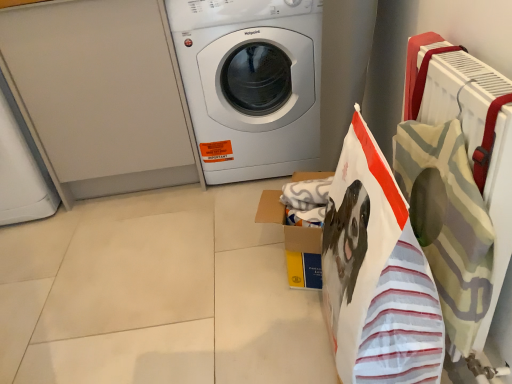
Question: Does white glossy washing machine at center turn towards yellow cardboard box at center?

Choices:
 (A) yes
 (B) no

Answer: (A)

Question: From a real-world perspective, is white glossy washing machine at center positioned under yellow cardboard box at center based on gravity?

Choices:
 (A) yes
 (B) no

Answer: (B)

Question: Is white glossy washing machine at center to the right of yellow cardboard box at center from the viewer's perspective?

Choices:
 (A) yes
 (B) no

Answer: (B)

Question: Considering the relative sizes of white glossy washing machine at center and yellow cardboard box at center in the image provided, is white glossy washing machine at center taller than yellow cardboard box at center?

Choices:
 (A) no
 (B) yes

Answer: (B)

Question: From the image's perspective, does white glossy washing machine at center appear lower than yellow cardboard box at center?

Choices:
 (A) no
 (B) yes

Answer: (A)

Question: Looking at their shapes, would you say white striped fabric shopping bag at right is wider or thinner than white glossy washing machine at center?

Choices:
 (A) wide
 (B) thin

Answer: (B)

Question: From a real-world perspective, is white striped fabric shopping bag at right positioned above or below white glossy washing machine at center?

Choices:
 (A) below
 (B) above

Answer: (A)

Question: Does point (425, 263) appear closer or farther from the camera than point (309, 125)?

Choices:
 (A) closer
 (B) farther

Answer: (A)

Question: Considering the positions of white striped fabric shopping bag at right and white glossy washing machine at center in the image, is white striped fabric shopping bag at right taller or shorter than white glossy washing machine at center?

Choices:
 (A) short
 (B) tall

Answer: (A)

Question: Would you say white glossy washing machine at center is inside or outside yellow cardboard box at center?

Choices:
 (A) outside
 (B) inside

Answer: (A)

Question: Is white glossy washing machine at center bigger or smaller than yellow cardboard box at center?

Choices:
 (A) small
 (B) big

Answer: (B)

Question: From the image's perspective, relative to yellow cardboard box at center, is white glossy washing machine at center above or below?

Choices:
 (A) above
 (B) below

Answer: (A)

Question: Considering their positions, is white glossy washing machine at center located in front of or behind yellow cardboard box at center?

Choices:
 (A) behind
 (B) front

Answer: (A)

Question: Considering the positions of white striped fabric shopping bag at right and yellow cardboard box at center in the image, is white striped fabric shopping bag at right bigger or smaller than yellow cardboard box at center?

Choices:
 (A) small
 (B) big

Answer: (B)

Question: Considering the positions of point pyautogui.click(x=417, y=342) and point pyautogui.click(x=294, y=264), is point pyautogui.click(x=417, y=342) closer or farther from the camera than point pyautogui.click(x=294, y=264)?

Choices:
 (A) closer
 (B) farther

Answer: (A)